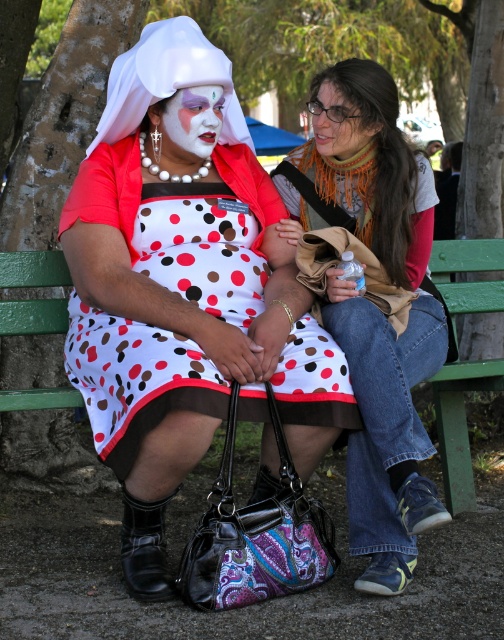
Question: Is polka dot dress at center thinner than white matte face paint at center?

Choices:
 (A) no
 (B) yes

Answer: (A)

Question: Is denim jeans at center bigger than white matte face paint at center?

Choices:
 (A) yes
 (B) no

Answer: (A)

Question: Which point is closer to the camera taking this photo?

Choices:
 (A) (348, 128)
 (B) (437, 381)
 (C) (422, 524)
 (D) (168, 301)

Answer: (C)

Question: Is green painted wood bench at center below matte orange hair at upper right?

Choices:
 (A) yes
 (B) no

Answer: (A)

Question: Which is farther from the polka dot dress at center?

Choices:
 (A) matte orange hair at upper right
 (B) green painted wood bench at center
 (C) white matte face paint at center

Answer: (B)

Question: Considering the real-world distances, which object is closest to the polka dot dress at center?

Choices:
 (A) white matte face paint at center
 (B) denim jeans at center
 (C) matte orange hair at upper right
 (D) green painted wood bench at center

Answer: (A)